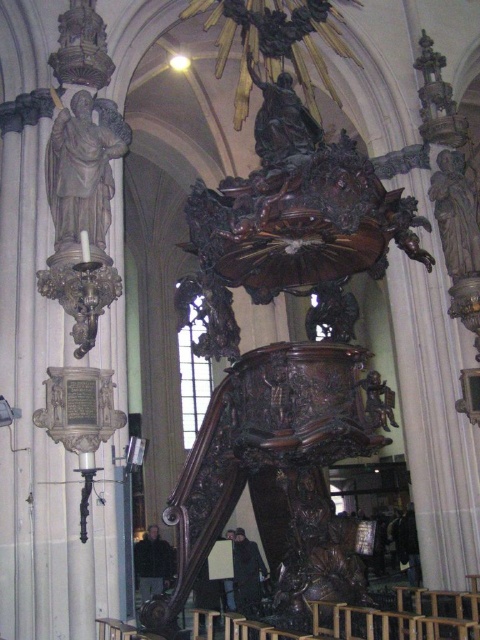
Question: Which is nearer to the bronze statue at upper center?

Choices:
 (A) matte stone statue at left
 (B) brown polished wood statue at right

Answer: (A)

Question: Which of these objects is positioned closest to the matte stone statue at left?

Choices:
 (A) brown polished wood statue at right
 (B) bronze statue at upper center

Answer: (B)

Question: Which is farther from the bronze statue at upper center?

Choices:
 (A) brown polished wood statue at right
 (B) matte stone statue at left

Answer: (A)

Question: Does matte stone statue at left appear on the right side of bronze statue at upper center?

Choices:
 (A) no
 (B) yes

Answer: (A)

Question: Is brown polished wood statue at right to the left of bronze statue at upper center from the viewer's perspective?

Choices:
 (A) no
 (B) yes

Answer: (A)

Question: Does matte stone statue at left appear on the right side of brown polished wood statue at right?

Choices:
 (A) yes
 (B) no

Answer: (B)